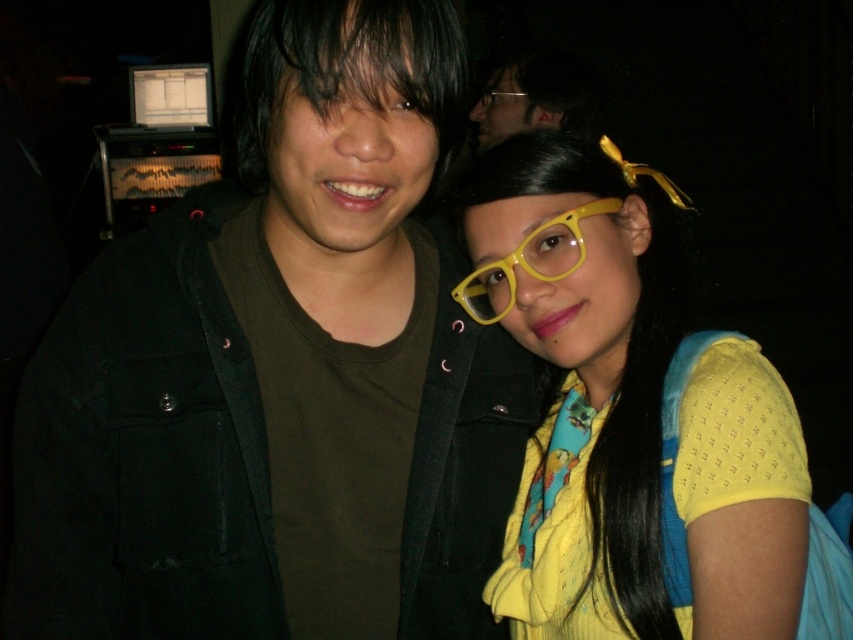
Measure the distance between black matte jacket at left and camera.

black matte jacket at left is 29.07 inches away from camera.

From the picture: Can you confirm if black matte jacket at left is positioned above yellow plastic glasses at center?

No.

Locate an element on the screen. The height and width of the screenshot is (640, 853). black matte jacket at left is located at coordinates (279, 356).

You are a GUI agent. You are given a task and a screenshot of the screen. Output one action in this format:
    pyautogui.click(x=<x>, y=<y>)
    Task: Click on the black matte jacket at left
    
    Given the screenshot: What is the action you would take?
    pyautogui.click(x=279, y=356)

Can you confirm if yellow plastic glasses at center is positioned below yellow plastic glasses at upper center?

Yes.

Is yellow plastic glasses at center thinner than yellow plastic glasses at upper center?

No.

Which is in front, point (573, 250) or point (502, 90)?

Point (573, 250) is more forward.

Find the location of a particular element. Image resolution: width=853 pixels, height=640 pixels. yellow plastic glasses at center is located at coordinates (529, 262).

Consider the image. Can you confirm if black matte jacket at left is positioned below yellow matte glasses at center?

Actually, black matte jacket at left is above yellow matte glasses at center.

Can you confirm if black matte jacket at left is positioned to the left of yellow matte glasses at center?

Yes, black matte jacket at left is to the left of yellow matte glasses at center.

The image size is (853, 640). I want to click on black matte jacket at left, so click(x=279, y=356).